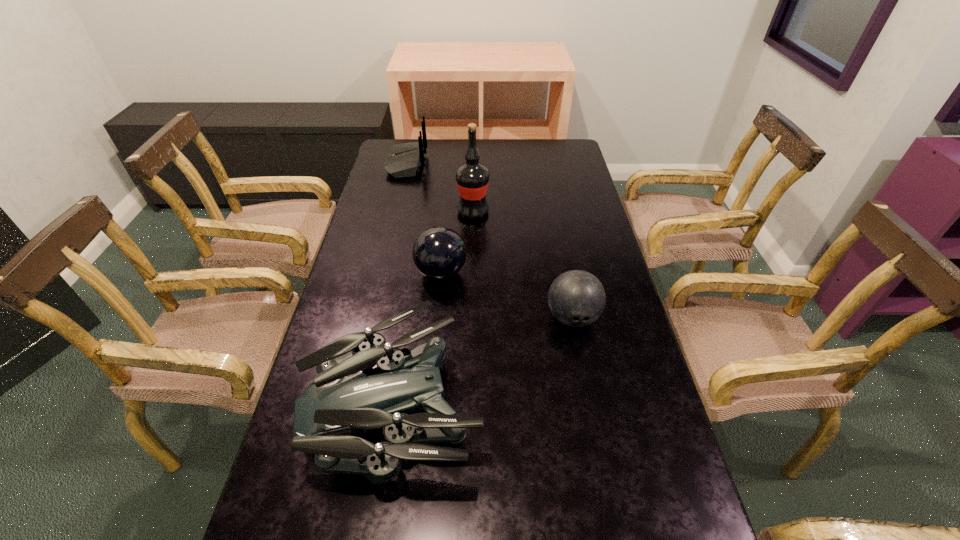
Locate an element on the screen. The width and height of the screenshot is (960, 540). free space located on the side of the farther bowling ball with the finger holes is located at coordinates (496, 273).

Locate an element on the screen. This screenshot has height=540, width=960. blank area located 0.390m on the grip area of the right bowling ball is located at coordinates (608, 495).

Where is `vacant space located on the back of the drone`? vacant space located on the back of the drone is located at coordinates (417, 264).

At what (x,y) coordinates should I click in order to perform the action: click on object that is at the far edge. Please return your answer as a coordinate pair (x, y). The width and height of the screenshot is (960, 540). Looking at the image, I should click on (404, 160).

Find the location of a particular element. router at the left edge is located at coordinates (404, 160).

Locate an element on the screen. This screenshot has width=960, height=540. drone situated at the left edge is located at coordinates (342, 403).

You are a GUI agent. You are given a task and a screenshot of the screen. Output one action in this format:
    pyautogui.click(x=<x>, y=<y>)
    Task: Click on the object positioned at the right edge
    The width and height of the screenshot is (960, 540).
    Given the screenshot: What is the action you would take?
    [576, 298]

Find the location of a particular element. This screenshot has height=540, width=960. object that is positioned at the far left corner is located at coordinates (404, 160).

Find the location of `free space at the far edge of the desktop`. free space at the far edge of the desktop is located at coordinates (464, 151).

In the image, there is a desktop. Where is `vacant space at the left edge`? The image size is (960, 540). vacant space at the left edge is located at coordinates (398, 240).